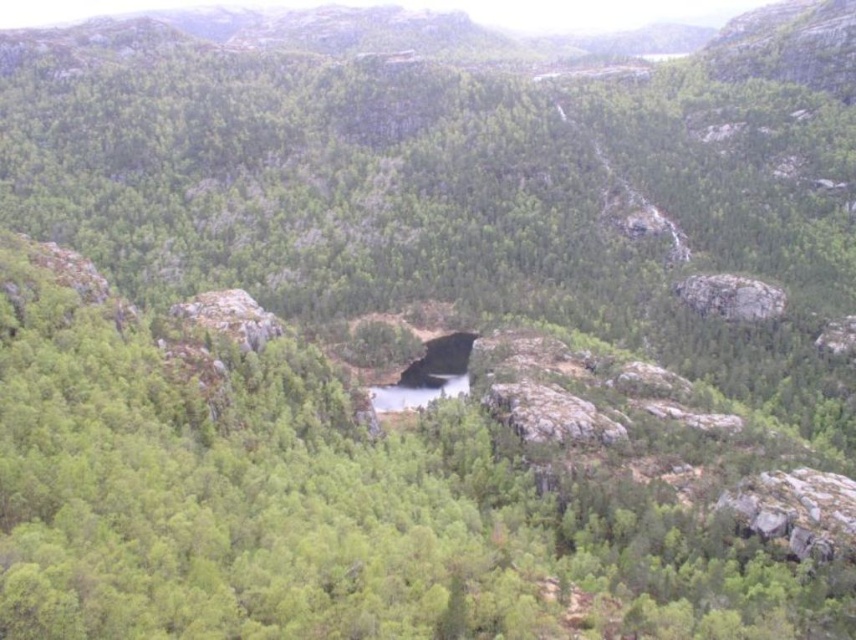
Question: Is green matte tree at center below rough gray rock at upper right?

Choices:
 (A) yes
 (B) no

Answer: (A)

Question: Does green matte tree at center appear on the right side of rough gray rock at upper right?

Choices:
 (A) yes
 (B) no

Answer: (B)

Question: Is green matte tree at center further to camera compared to rough gray rock at upper right?

Choices:
 (A) no
 (B) yes

Answer: (A)

Question: Which of the following is the farthest from the observer?

Choices:
 (A) rough gray rock at upper right
 (B) green matte tree at center

Answer: (A)